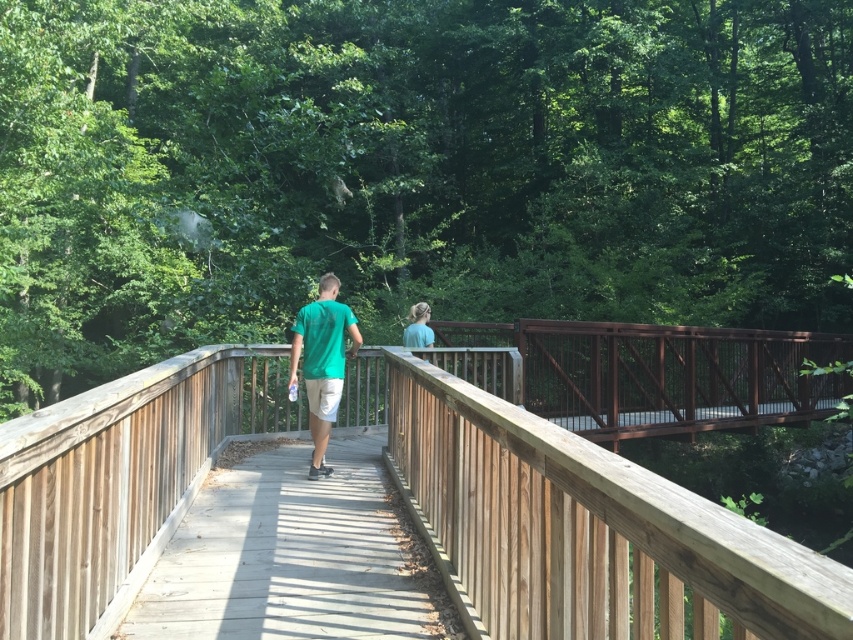
Looking at this image, who is taller, stained wood bridge at center or light blue shirt at center?

With more height is stained wood bridge at center.

Between stained wood bridge at center and light blue shirt at center, which one appears on the right side from the viewer's perspective?

stained wood bridge at center is more to the right.

Where is `stained wood bridge at center`? Image resolution: width=853 pixels, height=640 pixels. stained wood bridge at center is located at coordinates (654, 374).

This screenshot has height=640, width=853. I want to click on stained wood bridge at center, so click(654, 374).

Between wooden railing at center and green matte shirt at center, which one is positioned lower?

wooden railing at center

Can you confirm if wooden railing at center is positioned above green matte shirt at center?

No, wooden railing at center is not above green matte shirt at center.

Is point (712, 621) positioned after point (306, 323)?

No, it is in front of (306, 323).

Find the location of a particular element. The image size is (853, 640). wooden railing at center is located at coordinates (575, 518).

Does wooden walkway at center appear under stained wood bridge at center?

Yes.

Does point (263, 563) come behind point (751, 401)?

No, (263, 563) is in front of (751, 401).

Is point (344, 560) positioned behind point (618, 388)?

No, it is not.

You are a GUI agent. You are given a task and a screenshot of the screen. Output one action in this format:
    pyautogui.click(x=<x>, y=<y>)
    Task: Click on the wooden walkway at center
    The image size is (853, 640).
    Given the screenshot: What is the action you would take?
    pyautogui.click(x=294, y=556)